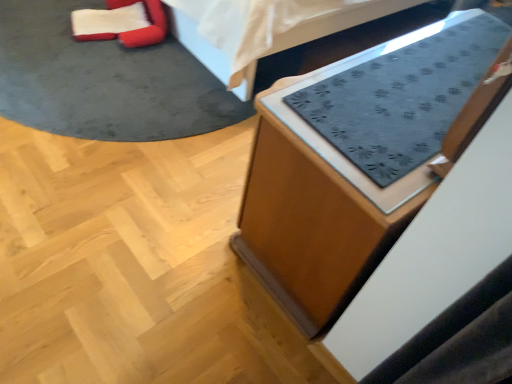
The image size is (512, 384). Find the location of `vacant space situated on the left part of wooden cabinet at lower right, which is the second furniture from top to bottom`. vacant space situated on the left part of wooden cabinet at lower right, which is the second furniture from top to bottom is located at coordinates (151, 202).